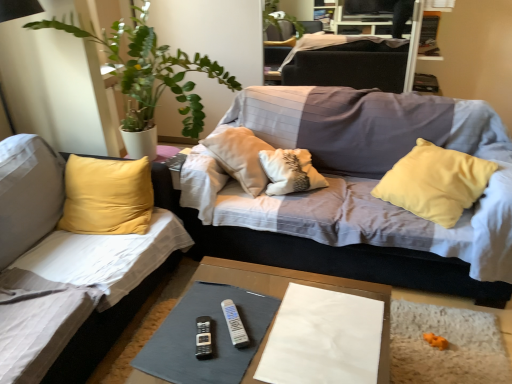
Locate an element on the screen. vacant space to the left of white paper at center is located at coordinates (221, 325).